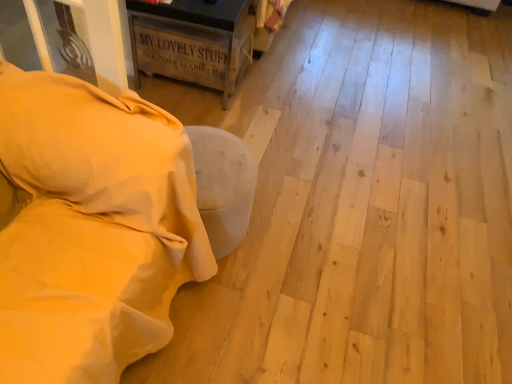
You are a GUI agent. You are given a task and a screenshot of the screen. Output one action in this format:
    pyautogui.click(x=<x>, y=<y>)
    Task: Click on the vacant point to the right of rustic wood crate at upper left, which is the first furniture from top to bottom
    Image resolution: width=512 pixels, height=384 pixels.
    Given the screenshot: What is the action you would take?
    pyautogui.click(x=286, y=103)